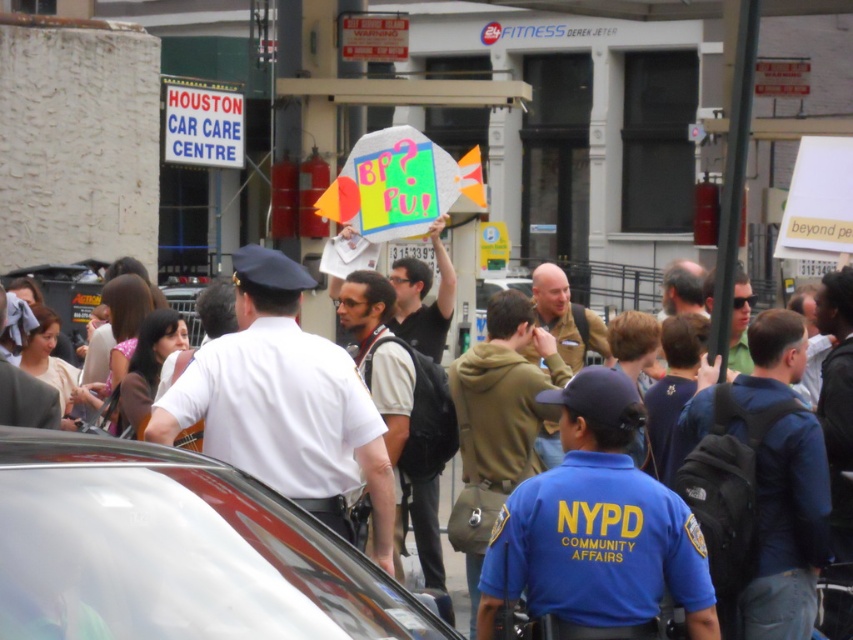
Can you confirm if white uniform shirt at center is shorter than dark brown leather backpack at center?

Yes, white uniform shirt at center is shorter than dark brown leather backpack at center.

Measure the distance from white uniform shirt at center to dark brown leather backpack at center.

white uniform shirt at center is 7.05 feet away from dark brown leather backpack at center.

This screenshot has width=853, height=640. What are the coordinates of `white uniform shirt at center` in the screenshot? It's located at (283, 403).

Find the location of a particular element. The image size is (853, 640). white uniform shirt at center is located at coordinates (283, 403).

Can you confirm if white uniform shirt at center is positioned below blue fabric backpack at center-right?

Correct, white uniform shirt at center is located below blue fabric backpack at center-right.

Does white uniform shirt at center have a greater width compared to blue fabric backpack at center-right?

Yes, white uniform shirt at center is wider than blue fabric backpack at center-right.

Is point (264, 381) closer to camera compared to point (817, 465)?

That is True.

Where is `white uniform shirt at center`? This screenshot has width=853, height=640. white uniform shirt at center is located at coordinates (283, 403).

Between point (251, 380) and point (178, 88), which one is positioned behind?

Point (178, 88)

Is white uniform shirt at center closer to the viewer compared to red plastic sign at upper left?

Yes, it is in front of red plastic sign at upper left.

Does point (234, 435) come farther from viewer compared to point (181, 157)?

No, (234, 435) is closer to viewer.

Where is `white uniform shirt at center`? white uniform shirt at center is located at coordinates (283, 403).